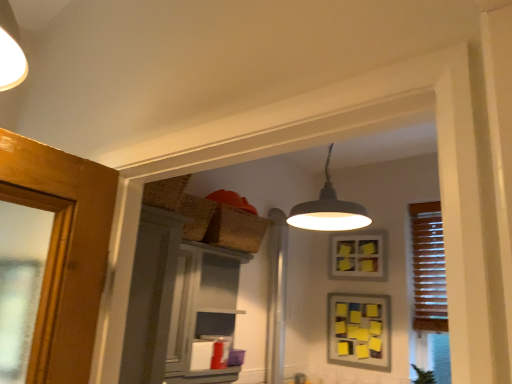
Question: Is matte gray screen door at left inside the boundaries of wooden blinds at right, or outside?

Choices:
 (A) inside
 (B) outside

Answer: (B)

Question: Is matte gray screen door at left in front of or behind wooden blinds at right in the image?

Choices:
 (A) front
 (B) behind

Answer: (A)

Question: Which object is positioned farthest from the white glossy cabinet at upper center?

Choices:
 (A) wooden blinds at right
 (B) yellow paper picture frame at center, the first picture frame ordered from the bottom
 (C) yellow sticky notes at upper center, the 2th picture frame in the bottom-to-top sequence
 (D) green leafy plant at lower right
 (E) matte gray screen door at left

Answer: (D)

Question: Estimate the real-world distances between objects in this image. Which object is closer to the yellow sticky notes at upper center, the 1th picture frame in the top-to-bottom sequence?

Choices:
 (A) wooden blinds at right
 (B) white glossy cabinet at upper center
 (C) woven brown basket at upper center
 (D) green leafy plant at lower right
 (E) yellow paper picture frame at center, the first picture frame ordered from the bottom

Answer: (E)